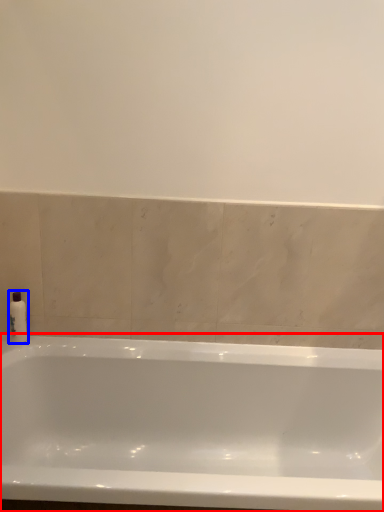
Question: Which of the following is the closest to the observer, bathtub (highlighted by a red box) or soap dispenser (highlighted by a blue box)?

Choices:
 (A) bathtub
 (B) soap dispenser

Answer: (A)